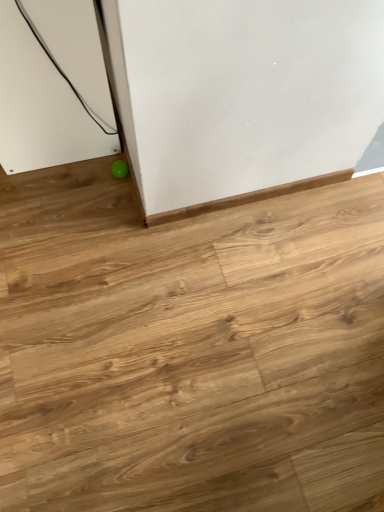
Question: From the image's perspective, is light brown wood floor at lower left on green rubber ball at lower left?

Choices:
 (A) no
 (B) yes

Answer: (A)

Question: Is light brown wood floor at lower left to the right of green rubber ball at lower left from the viewer's perspective?

Choices:
 (A) no
 (B) yes

Answer: (B)

Question: Is the position of light brown wood floor at lower left more distant than that of green rubber ball at lower left?

Choices:
 (A) no
 (B) yes

Answer: (A)

Question: Is light brown wood floor at lower left far away from green rubber ball at lower left?

Choices:
 (A) yes
 (B) no

Answer: (B)

Question: From a real-world perspective, is light brown wood floor at lower left positioned over green rubber ball at lower left based on gravity?

Choices:
 (A) yes
 (B) no

Answer: (B)

Question: Is light brown wood floor at lower left oriented towards green rubber ball at lower left?

Choices:
 (A) no
 (B) yes

Answer: (A)

Question: Is green rubber ball at lower left closer to the viewer compared to light brown wood floor at lower left?

Choices:
 (A) yes
 (B) no

Answer: (B)

Question: Is green rubber ball at lower left positioned with its back to light brown wood floor at lower left?

Choices:
 (A) yes
 (B) no

Answer: (A)

Question: From the image's perspective, is green rubber ball at lower left located above light brown wood floor at lower left?

Choices:
 (A) no
 (B) yes

Answer: (B)

Question: From a real-world perspective, is green rubber ball at lower left positioned over light brown wood floor at lower left based on gravity?

Choices:
 (A) yes
 (B) no

Answer: (A)

Question: Is green rubber ball at lower left located outside light brown wood floor at lower left?

Choices:
 (A) no
 (B) yes

Answer: (A)

Question: Does green rubber ball at lower left appear on the left side of light brown wood floor at lower left?

Choices:
 (A) no
 (B) yes

Answer: (B)

Question: From the image's perspective, is green rubber ball at lower left positioned above or below light brown wood floor at lower left?

Choices:
 (A) below
 (B) above

Answer: (B)